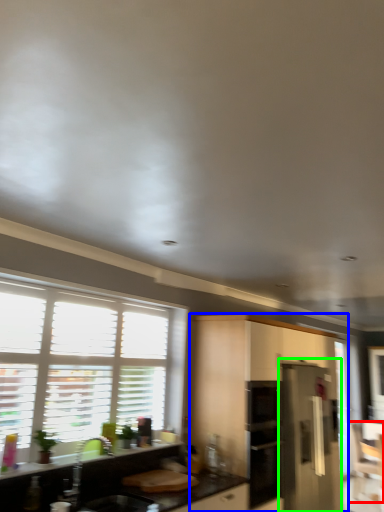
Question: Which object is the farthest from armchair (highlighted by a red box)? Choose among these: cabinetry (highlighted by a blue box) or appliance (highlighted by a green box).

Choices:
 (A) cabinetry
 (B) appliance

Answer: (A)